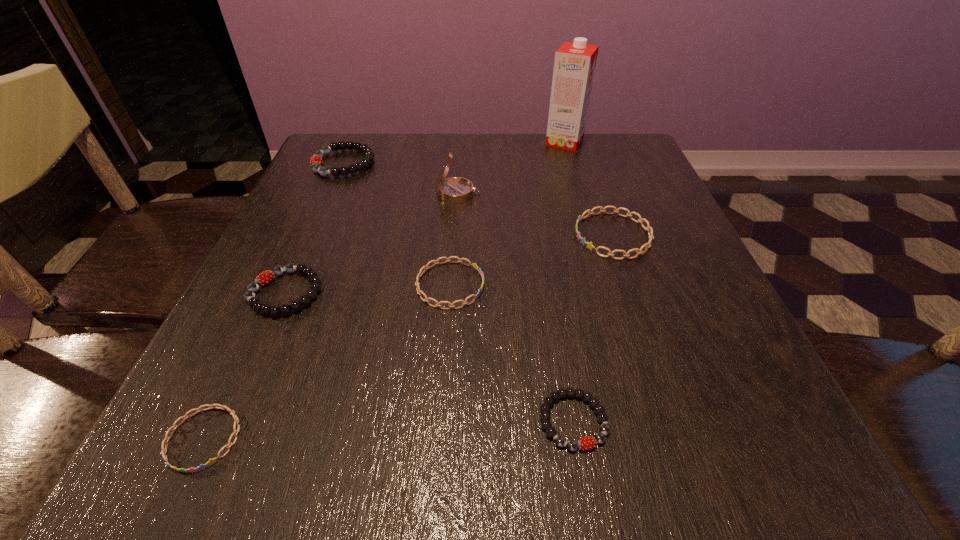
The width and height of the screenshot is (960, 540). In order to click on free space located on the back of the second smallest black bracelet in this screenshot , I will do `click(307, 244)`.

Find the location of a particular element. Image resolution: width=960 pixels, height=540 pixels. blank space located 0.200m on the surface of the third bracelet from right to left showing star-shaped elements is located at coordinates (599, 285).

Find the location of a particular element. The width and height of the screenshot is (960, 540). free space located 0.210m on the back of the smallest black bracelet is located at coordinates (551, 285).

At what (x,y) coordinates should I click in order to perform the action: click on carton that is at the far edge. Please return your answer as a coordinate pair (x, y). Looking at the image, I should click on (574, 66).

Find the location of a particular element. This screenshot has height=540, width=960. bracelet at the far edge is located at coordinates (316, 160).

Where is `carton that is at the right edge`? carton that is at the right edge is located at coordinates (574, 66).

The image size is (960, 540). In order to click on bracelet that is at the right edge in this screenshot , I will do `click(589, 245)`.

You are a GUI agent. You are given a task and a screenshot of the screen. Output one action in this format:
    pyautogui.click(x=<x>, y=<y>)
    Task: Click on the object located in the far left corner section of the desktop
    
    Given the screenshot: What is the action you would take?
    pyautogui.click(x=316, y=160)

At what (x,y) coordinates should I click in order to perform the action: click on object present at the near left corner. Please return your answer as a coordinate pair (x, y). Looking at the image, I should click on (166, 439).

This screenshot has height=540, width=960. What are the coordinates of `object present at the far right corner` in the screenshot? It's located at (574, 66).